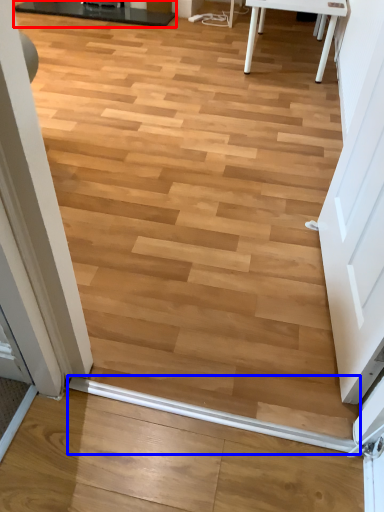
Question: Which object appears farthest to the camera in this image, table (highlighted by a red box) or beam (highlighted by a blue box)?

Choices:
 (A) table
 (B) beam

Answer: (A)